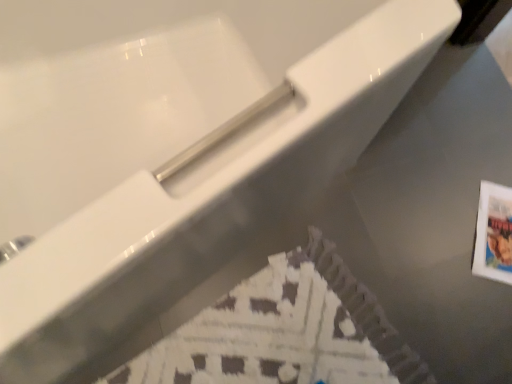
Where is `vacant region above printed paper postcard at lower right (from a real-world perspective)`? The image size is (512, 384). vacant region above printed paper postcard at lower right (from a real-world perspective) is located at coordinates coord(497,235).